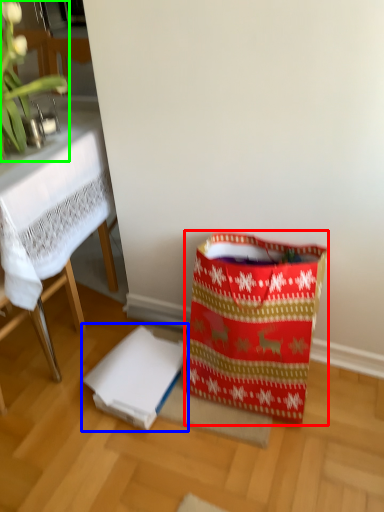
Question: Which is nearer to the shopping bag (highlighted by a red box)? cardboard box (highlighted by a blue box) or orchid (highlighted by a green box).

Choices:
 (A) cardboard box
 (B) orchid

Answer: (A)